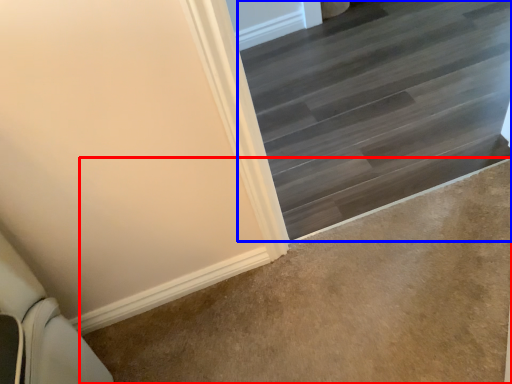
Question: Which object appears closest to the camera in this image, concrete (highlighted by a red box) or stairs (highlighted by a blue box)?

Choices:
 (A) concrete
 (B) stairs

Answer: (A)